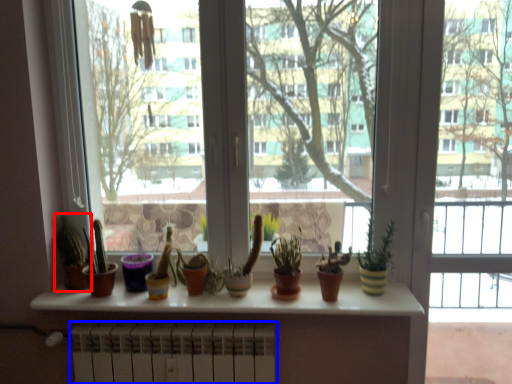
Question: Among these objects, which one is nearest to the camera, houseplant (highlighted by a red box) or radiator (highlighted by a blue box)?

Choices:
 (A) houseplant
 (B) radiator

Answer: (B)